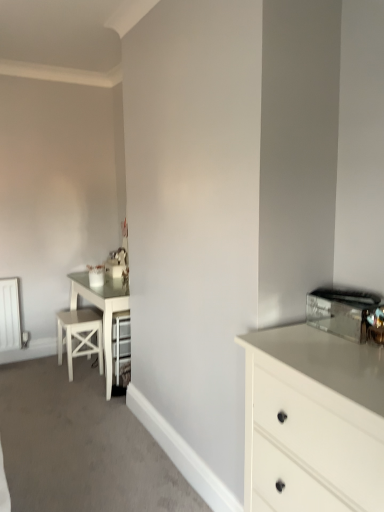
Where is `free space to the left of shiny metallic toaster at upper right`? The height and width of the screenshot is (512, 384). free space to the left of shiny metallic toaster at upper right is located at coordinates (296, 335).